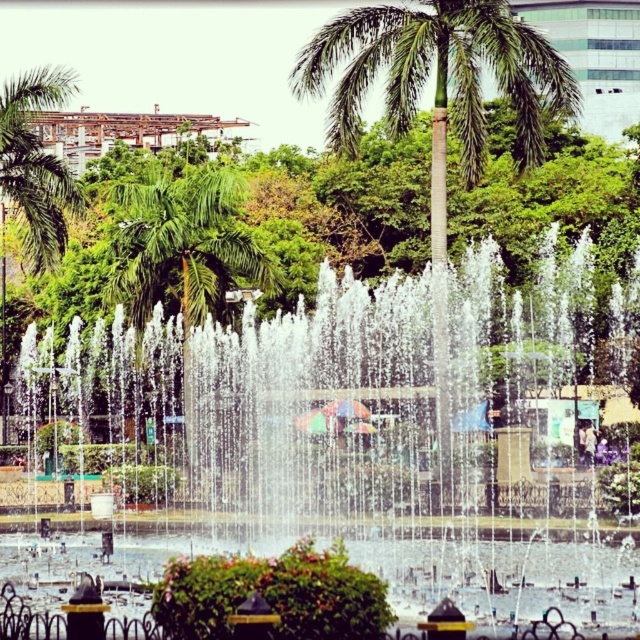
You are a landscape architect designing a new park layout. You need to ensure that the clear water fountain at center is visible from all angles around it. Considering the green leafy palm tree at center, will the tree obstruct the view of the fountain?

The clear water fountain at center is taller than the green leafy palm tree at center, so the fountain will remain visible from all angles around it as the palm tree won

You are a drone operator who needs to fly a drone between the clear water fountain at center and the green leafy palm tree at center. The drone has a maximum flight distance of 12 meters. Can the drone safely fly between these two points without exceeding its range?

Result: The clear water fountain at center and green leafy palm tree at center are 13.13 meters apart from each other. Since the drone can only fly up to 12 meters, it cannot safely fly between these two points without exceeding its range.